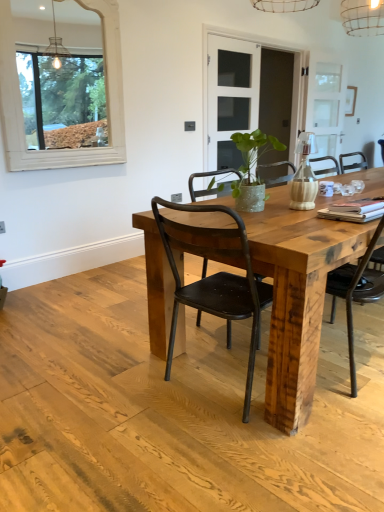
Question: From the image's perspective, would you say matte white vase at center is positioned over clear glass door at center?

Choices:
 (A) no
 (B) yes

Answer: (A)

Question: Is matte white vase at center facing away from clear glass door at center?

Choices:
 (A) no
 (B) yes

Answer: (A)

Question: Does matte white vase at center contain clear glass door at center?

Choices:
 (A) yes
 (B) no

Answer: (B)

Question: From a real-world perspective, is matte white vase at center on clear glass door at center?

Choices:
 (A) no
 (B) yes

Answer: (A)

Question: Is matte white vase at center taller than clear glass door at center?

Choices:
 (A) yes
 (B) no

Answer: (B)

Question: Does matte white vase at center have a smaller size compared to clear glass door at center?

Choices:
 (A) no
 (B) yes

Answer: (B)

Question: Considering the relative positions of white wooden frame at upper left and green textured vase at center in the image provided, is white wooden frame at upper left to the right of green textured vase at center from the viewer's perspective?

Choices:
 (A) no
 (B) yes

Answer: (A)

Question: Does white wooden frame at upper left have a larger size compared to green textured vase at center?

Choices:
 (A) yes
 (B) no

Answer: (A)

Question: Can you confirm if white wooden frame at upper left is taller than green textured vase at center?

Choices:
 (A) yes
 (B) no

Answer: (A)

Question: Can you confirm if white wooden frame at upper left is thinner than green textured vase at center?

Choices:
 (A) yes
 (B) no

Answer: (A)

Question: From a real-world perspective, is white wooden frame at upper left over green textured vase at center?

Choices:
 (A) yes
 (B) no

Answer: (A)

Question: Is the position of white wooden frame at upper left less distant than that of green textured vase at center?

Choices:
 (A) yes
 (B) no

Answer: (B)

Question: Can you confirm if reclaimed wood table at center is positioned to the left of matte white vase at center?

Choices:
 (A) yes
 (B) no

Answer: (B)